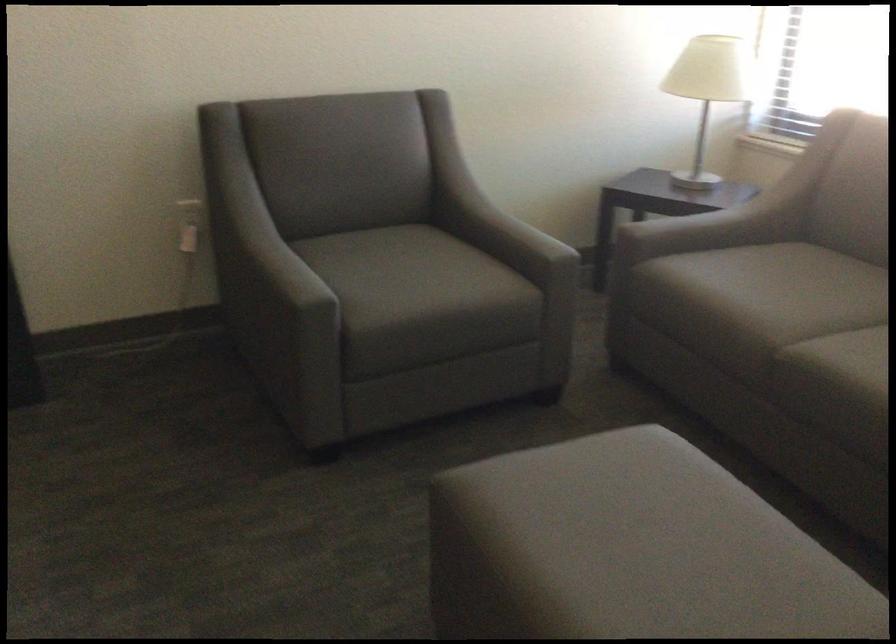
The width and height of the screenshot is (896, 644). I want to click on ottoman top surface, so click(x=633, y=542).